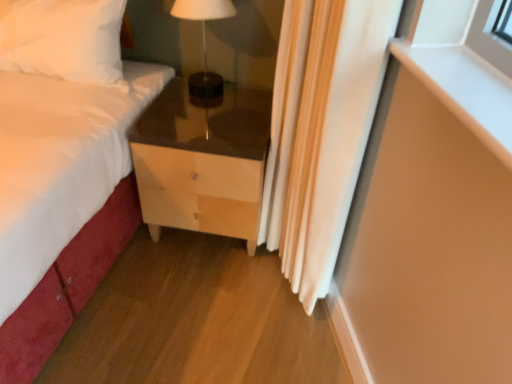
Question: Is matte brown table lamp at center not inside white fabric curtain at right?

Choices:
 (A) yes
 (B) no

Answer: (A)

Question: Is matte brown table lamp at center shorter than white fabric curtain at right?

Choices:
 (A) no
 (B) yes

Answer: (B)

Question: Is the surface of matte brown table lamp at center in direct contact with white fabric curtain at right?

Choices:
 (A) yes
 (B) no

Answer: (B)

Question: Considering the relative sizes of matte brown table lamp at center and white fabric curtain at right in the image provided, is matte brown table lamp at center smaller than white fabric curtain at right?

Choices:
 (A) no
 (B) yes

Answer: (B)

Question: Is matte brown table lamp at center to the left of white fabric curtain at right from the viewer's perspective?

Choices:
 (A) yes
 (B) no

Answer: (A)

Question: Considering the relative positions of matte brown table lamp at center and white fabric curtain at right in the image provided, is matte brown table lamp at center to the right of white fabric curtain at right from the viewer's perspective?

Choices:
 (A) yes
 (B) no

Answer: (B)

Question: Is matte wood chest of drawers at lower center closer to the viewer compared to matte brown table lamp at center?

Choices:
 (A) yes
 (B) no

Answer: (A)

Question: Considering the relative sizes of matte wood chest of drawers at lower center and matte brown table lamp at center in the image provided, is matte wood chest of drawers at lower center wider than matte brown table lamp at center?

Choices:
 (A) yes
 (B) no

Answer: (A)

Question: Does matte wood chest of drawers at lower center turn towards matte brown table lamp at center?

Choices:
 (A) no
 (B) yes

Answer: (A)

Question: From the image's perspective, is matte wood chest of drawers at lower center located above matte brown table lamp at center?

Choices:
 (A) yes
 (B) no

Answer: (B)

Question: Is matte brown table lamp at center surrounded by matte wood chest of drawers at lower center?

Choices:
 (A) yes
 (B) no

Answer: (B)

Question: Is matte wood chest of drawers at lower center bigger than matte brown table lamp at center?

Choices:
 (A) yes
 (B) no

Answer: (A)

Question: Is matte wood chest of drawers at lower center surrounded by matte brown table lamp at center?

Choices:
 (A) yes
 (B) no

Answer: (B)